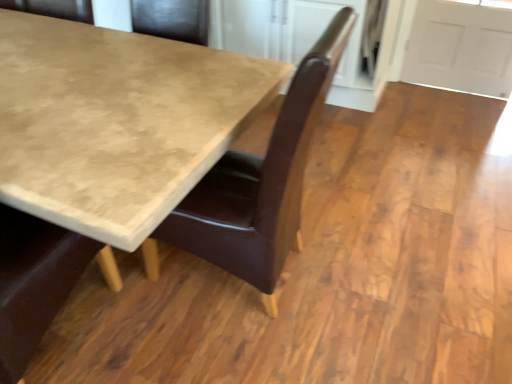
In order to face marble-like beige table at center, should I rotate leftwards or rightwards?

It's best to rotate left around 27.975 degrees.

Describe the element at coordinates (116, 123) in the screenshot. I see `marble-like beige table at center` at that location.

Locate an element on the screen. Image resolution: width=512 pixels, height=384 pixels. marble-like beige table at center is located at coordinates (116, 123).

Measure the distance between brown leather chair at center and camera.

The depth of brown leather chair at center is 36.73 inches.

Find the location of a particular element. brown leather chair at center is located at coordinates (261, 182).

This screenshot has height=384, width=512. What do you see at coordinates (261, 182) in the screenshot? I see `brown leather chair at center` at bounding box center [261, 182].

At what (x,y) coordinates should I click in order to perform the action: click on marble-like beige table at center. Please return your answer as a coordinate pair (x, y). The width and height of the screenshot is (512, 384). Looking at the image, I should click on (116, 123).

Based on their positions, is marble-like beige table at center located to the left or right of brown leather chair at center?

Based on their positions, marble-like beige table at center is located to the left of brown leather chair at center.

Is marble-like beige table at center closer to the viewer compared to brown leather chair at center?

Yes, marble-like beige table at center is in front of brown leather chair at center.

Considering the points (72, 183) and (228, 155), which point is behind, point (72, 183) or point (228, 155)?

The point (228, 155) is farther.

Consider the image. From the image's perspective, does marble-like beige table at center appear higher than brown leather chair at center?

Yes, from the image's perspective, marble-like beige table at center is over brown leather chair at center.

From a real-world perspective, is marble-like beige table at center on top of brown leather chair at center?

No, from a real-world perspective, marble-like beige table at center is not on top of brown leather chair at center.

Looking at their sizes, would you say marble-like beige table at center is wider or thinner than brown leather chair at center?

In the image, marble-like beige table at center appears to be wider than brown leather chair at center.

Considering the relative sizes of marble-like beige table at center and brown leather chair at center in the image provided, is marble-like beige table at center taller than brown leather chair at center?

Incorrect, the height of marble-like beige table at center is not larger of that of brown leather chair at center.

Considering the sizes of objects marble-like beige table at center and brown leather chair at center in the image provided, who is bigger, marble-like beige table at center or brown leather chair at center?

marble-like beige table at center is bigger.

Is marble-like beige table at center inside the boundaries of brown leather chair at center, or outside?

marble-like beige table at center is not enclosed by brown leather chair at center.

Are marble-like beige table at center and brown leather chair at center making contact?

marble-like beige table at center is not next to brown leather chair at center, and they're not touching.

Is marble-like beige table at center oriented towards brown leather chair at center?

No, marble-like beige table at center is not oriented towards brown leather chair at center.

Where is `chair lying behind the marble-like beige table at center`? chair lying behind the marble-like beige table at center is located at coordinates (261, 182).

Can you confirm if brown leather chair at center is positioned to the left of marble-like beige table at center?

No, brown leather chair at center is not to the left of marble-like beige table at center.

Does brown leather chair at center lie in front of marble-like beige table at center?

No, brown leather chair at center is further to the viewer.

Which is farther from the camera, (246, 241) or (250, 87)?

The point (250, 87) is behind.

From the image's perspective, is brown leather chair at center located above or below marble-like beige table at center?

From the image's perspective, brown leather chair at center appears below marble-like beige table at center.

From a real-world perspective, is brown leather chair at center above or below marble-like beige table at center?

From a real-world perspective, brown leather chair at center is physically above marble-like beige table at center.

Is brown leather chair at center thinner than marble-like beige table at center?

Correct, the width of brown leather chair at center is less than that of marble-like beige table at center.

Which of these two, brown leather chair at center or marble-like beige table at center, stands taller?

With more height is brown leather chair at center.

In terms of size, does brown leather chair at center appear bigger or smaller than marble-like beige table at center?

Clearly, brown leather chair at center is smaller in size than marble-like beige table at center.

Which is correct: brown leather chair at center is inside marble-like beige table at center, or outside of it?

brown leather chair at center is inside marble-like beige table at center.

Is brown leather chair at center not close to marble-like beige table at center?

Actually, brown leather chair at center and marble-like beige table at center are a little close together.

Could you tell me if brown leather chair at center is facing marble-like beige table at center?

Yes, brown leather chair at center is turned towards marble-like beige table at center.

At what (x,y) coordinates should I click in order to perform the action: click on table that is above the brown leather chair at center (from the image's perspective). Please return your answer as a coordinate pair (x, y). Looking at the image, I should click on (116, 123).

Locate an element on the screen. The image size is (512, 384). chair that is above the marble-like beige table at center (from a real-world perspective) is located at coordinates (261, 182).

Identify the location of table in front of the brown leather chair at center. The width and height of the screenshot is (512, 384). (116, 123).